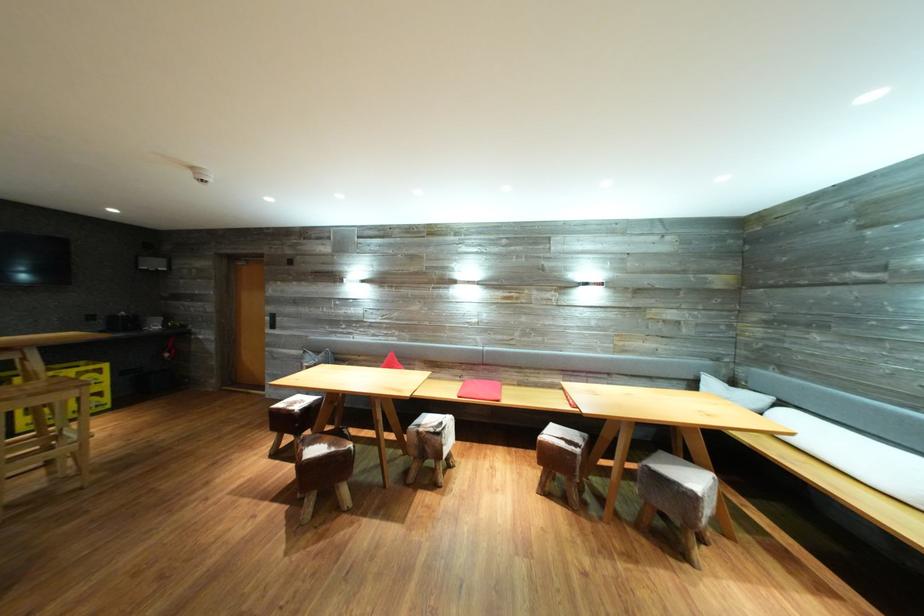
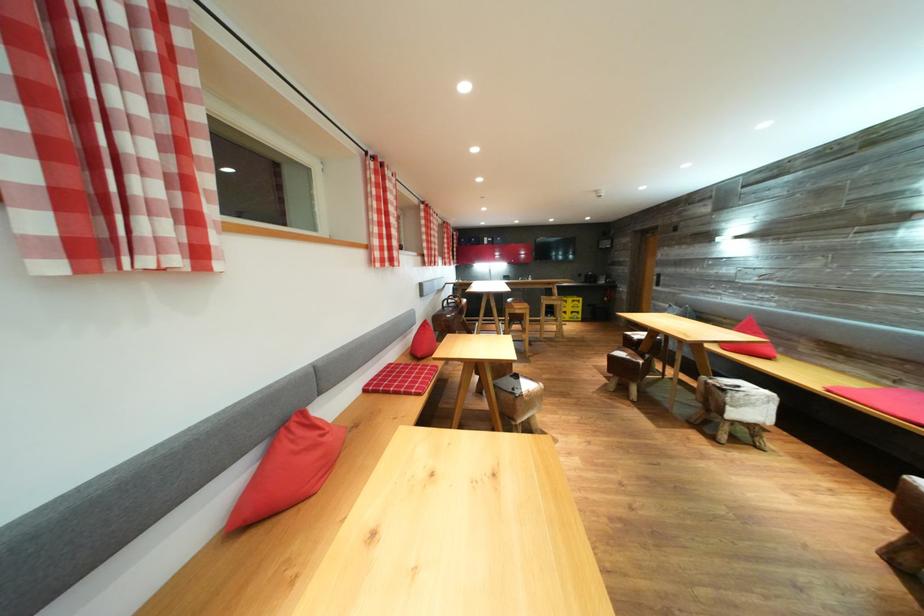
In the second image, find the point that corresponds to (x=447, y=429) in the first image.

(745, 392)